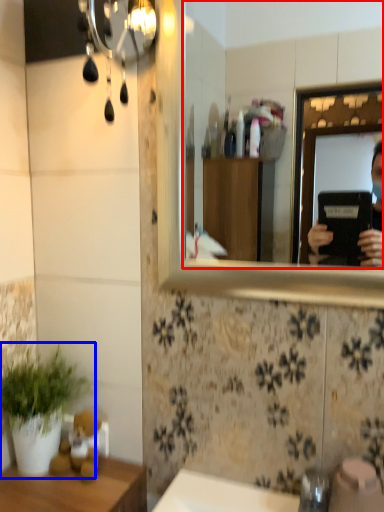
Question: Which point is further to the camera, mirror (highlighted by a red box) or houseplant (highlighted by a blue box)?

Choices:
 (A) mirror
 (B) houseplant

Answer: (B)